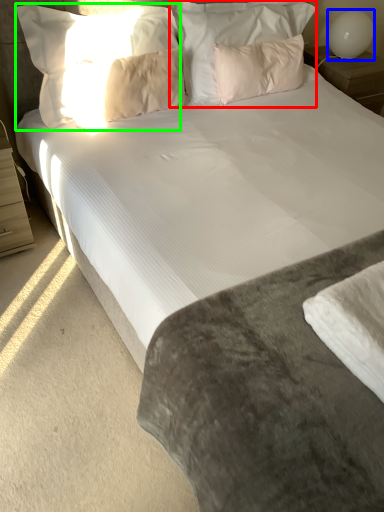
Question: Which object is the closest to the pillow (highlighted by a red box)? Choose among these: table lamp (highlighted by a blue box) or pillow (highlighted by a green box).

Choices:
 (A) table lamp
 (B) pillow

Answer: (B)